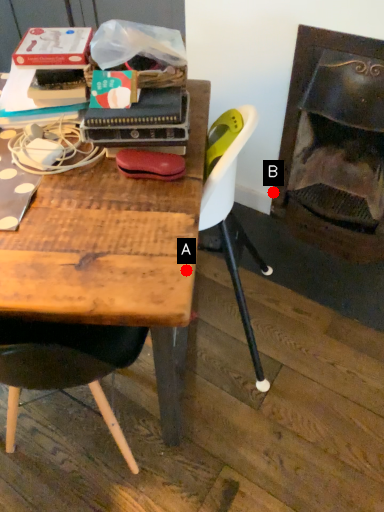
Question: Two points are circled on the image, labeled by A and B beside each circle. Which of the following is the farthest from the observer?

Choices:
 (A) A is further
 (B) B is further

Answer: (B)